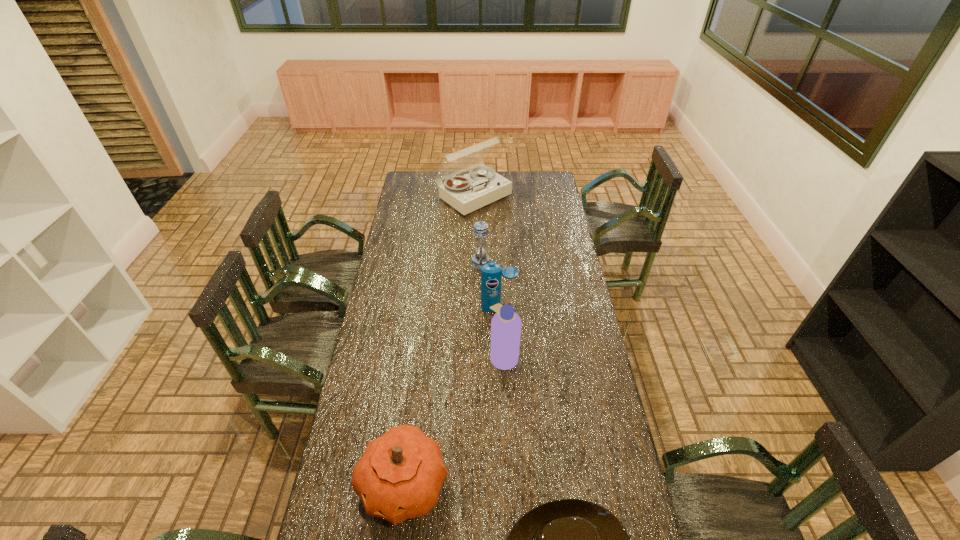
The height and width of the screenshot is (540, 960). I want to click on the farthest object, so (x=467, y=193).

Where is `the third nearest object`? This screenshot has width=960, height=540. the third nearest object is located at coordinates (506, 325).

You are a GUI agent. You are given a task and a screenshot of the screen. Output one action in this format:
    pyautogui.click(x=<x>, y=<y>)
    Task: Click on the third farthest object
    The image size is (960, 540).
    Given the screenshot: What is the action you would take?
    pyautogui.click(x=491, y=273)

Image resolution: width=960 pixels, height=540 pixels. I want to click on lantern, so click(480, 247).

The height and width of the screenshot is (540, 960). Identify the location of pumpkin. (399, 476).

Find the location of a particular element. This screenshot has height=540, width=960. free space located on the front of the farthest object is located at coordinates (473, 234).

You are a GUI agent. You are given a task and a screenshot of the screen. Output one action in this format:
    pyautogui.click(x=<x>, y=<y>)
    Task: Click on the free location located on the back of the nearer shampoo
    The height and width of the screenshot is (540, 960).
    Given the screenshot: What is the action you would take?
    pyautogui.click(x=500, y=287)

Identify the location of free region located on the front of the third farthest object. The image size is (960, 540). (501, 373).

Where is `free space located on the front-facing side of the lantern`? free space located on the front-facing side of the lantern is located at coordinates (428, 262).

Find the location of a particular element. The width and height of the screenshot is (960, 540). vacant point located on the front-facing side of the lantern is located at coordinates (397, 262).